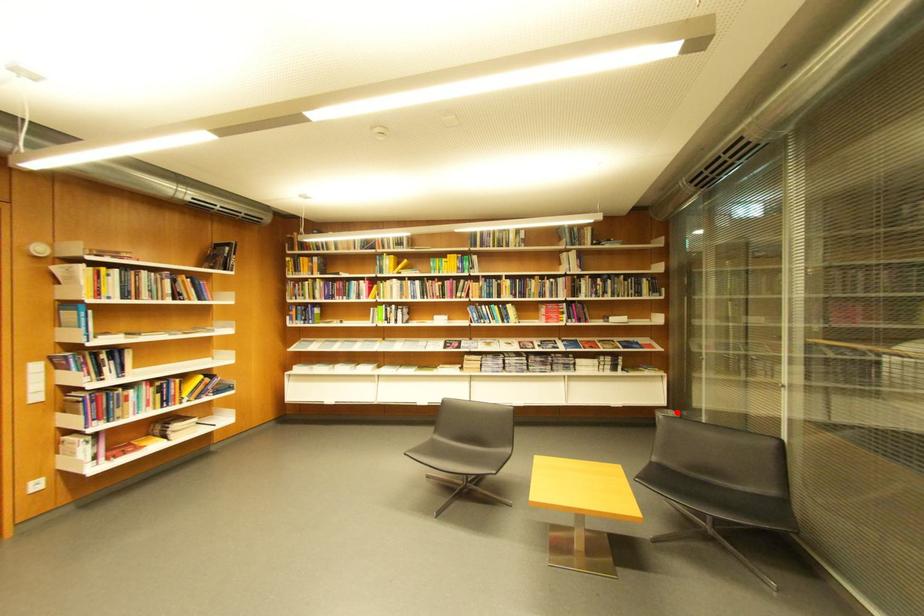
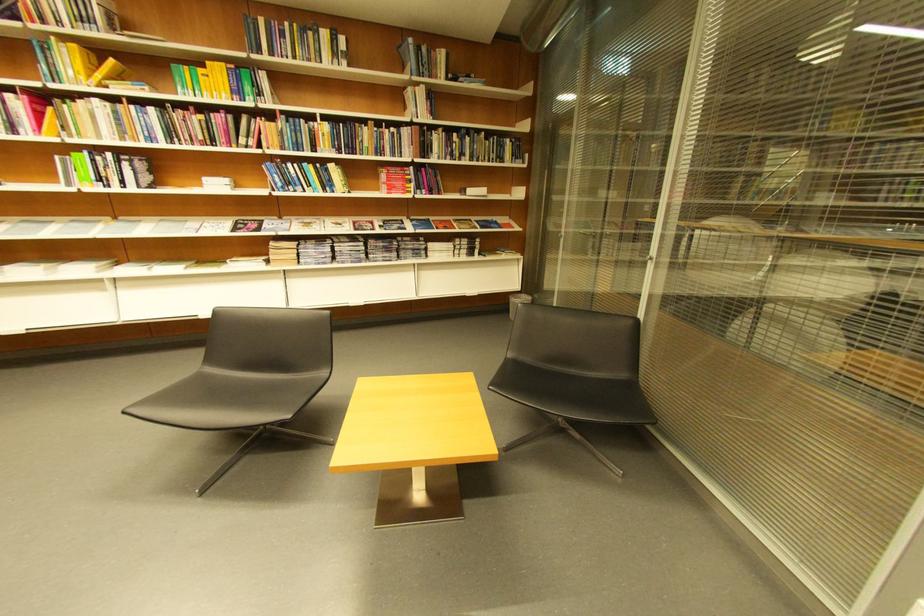
Question: I am providing you with two images of the same scene from different viewpoints. Given a red point in image1, look at the same physical point in image2. Is it:

Choices:
 (A) Closer to the viewpoint
 (B) Farther from the viewpoint

Answer: (A)